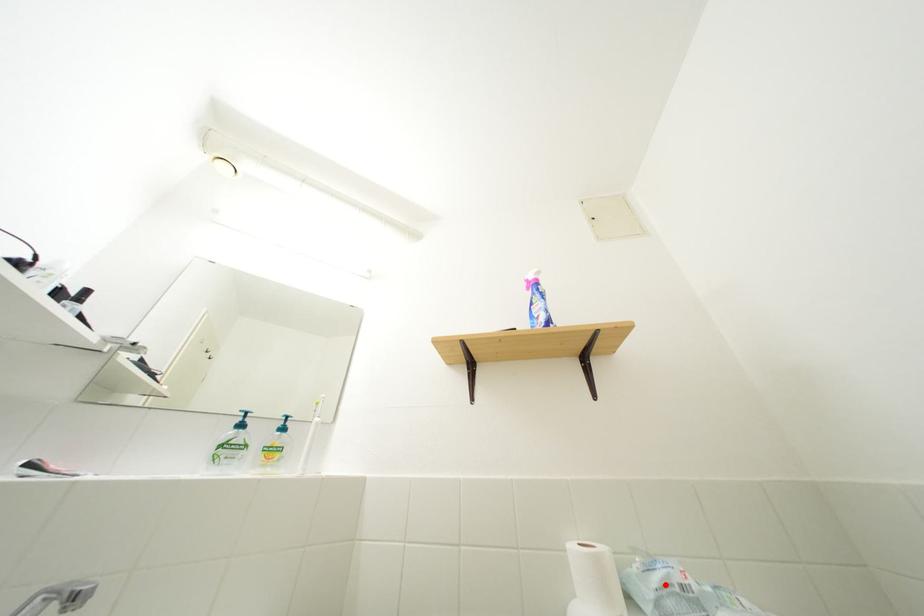
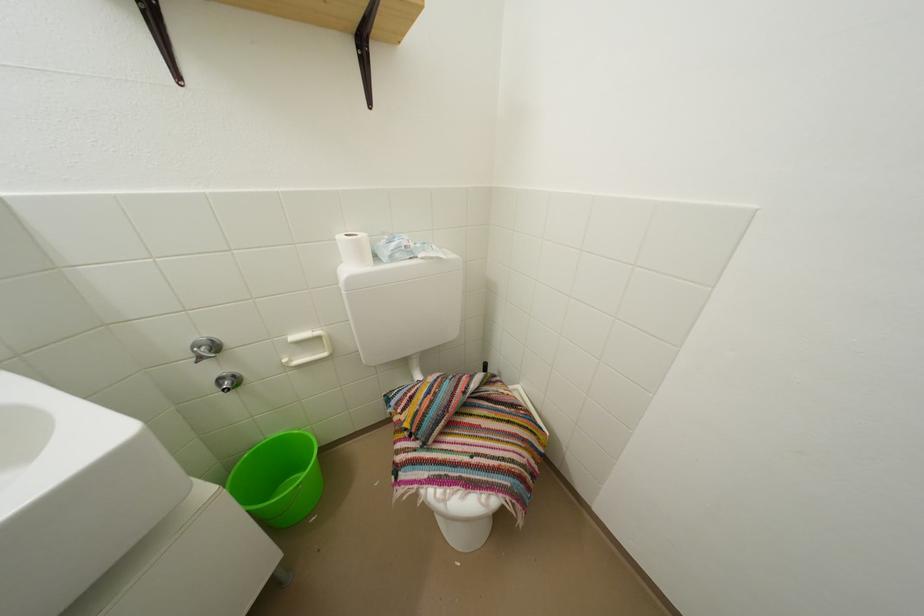
In the second image, find the point that corresponds to the highlighted location in the first image.

(402, 251)